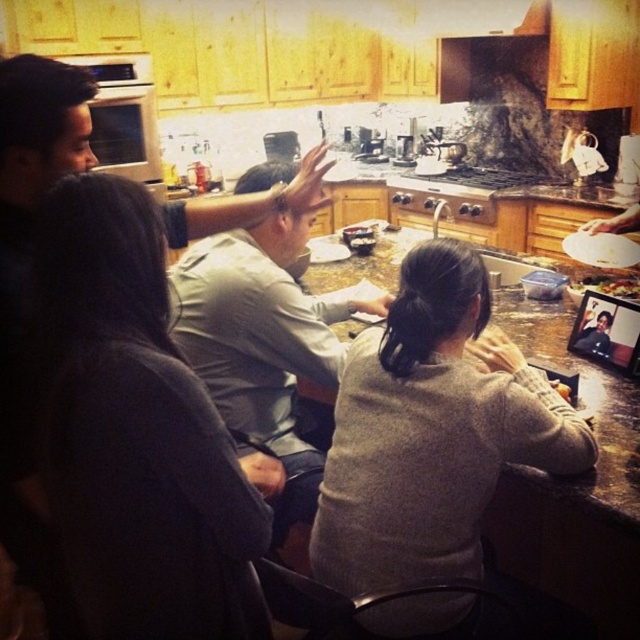
You are a guest in the kitchen and want to place your dark gray sweater at upper left on the granite gray counter top at center. Is there enough space for the sweater?

The dark gray sweater at upper left is currently in front of the granite gray counter top at center, which means it is already occupying space on the counter. Therefore, there may not be enough space to place the sweater there unless you move the existing items.

You are standing in the kitchen and want to place a small bowl on the counter near the dark gray sweater at upper left. Where should you place it?

Place the small bowl near the dark gray sweater at upper left at point (124, 412).